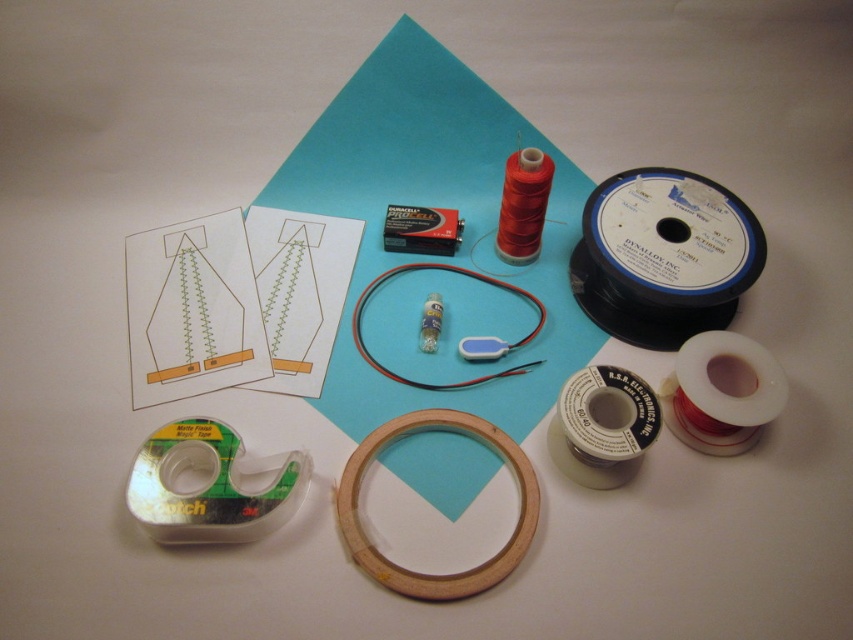
Question: Can you confirm if white matte tape at center right is wider than silver matte tape at center-right?

Choices:
 (A) no
 (B) yes

Answer: (B)

Question: Among these objects, which one is farthest from the camera?

Choices:
 (A) black matte spool at upper right
 (B) wooden ring at center
 (C) clear matte finish tape at lower left
 (D) white matte tape at center right

Answer: (A)

Question: Which object appears farthest from the camera in this image?

Choices:
 (A) wooden ring at center
 (B) black matte spool at upper right
 (C) silver matte tape at center-right

Answer: (B)

Question: Does black matte spool at upper right appear over black flexible wire at center?

Choices:
 (A) yes
 (B) no

Answer: (A)

Question: Does black matte spool at upper right come in front of wooden ring at center?

Choices:
 (A) yes
 (B) no

Answer: (B)

Question: Which object is closer to the camera taking this photo?

Choices:
 (A) black flexible wire at center
 (B) wooden ring at center
 (C) silver matte tape at center-right

Answer: (B)